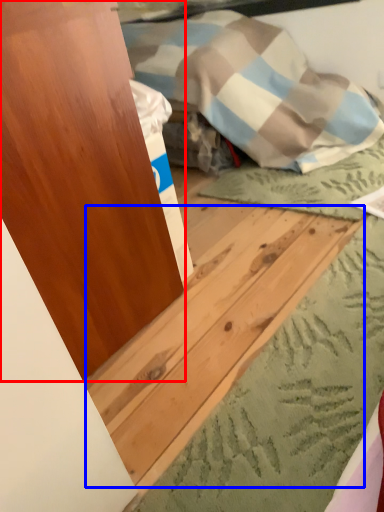
Question: Among these objects, which one is farthest to the camera, dresser (highlighted by a red box) or plywood (highlighted by a blue box)?

Choices:
 (A) dresser
 (B) plywood

Answer: (A)